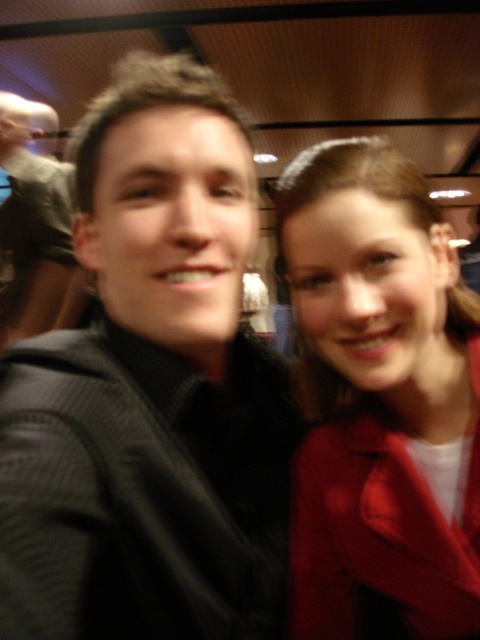
Question: Which point appears farthest from the camera in this image?

Choices:
 (A) (336, 195)
 (B) (12, 170)

Answer: (B)

Question: Which object appears farthest from the camera in this image?

Choices:
 (A) matte red coat at right
 (B) matte black sweater at center

Answer: (B)

Question: Does matte red coat at right have a larger size compared to matte black sweater at center?

Choices:
 (A) yes
 (B) no

Answer: (B)

Question: Is the position of matte red coat at right less distant than that of matte black sweater at center?

Choices:
 (A) no
 (B) yes

Answer: (B)

Question: Among these points, which one is farthest from the camera?

Choices:
 (A) 374,348
 (B) 0,321

Answer: (B)

Question: Observing the image, what is the correct spatial positioning of matte red coat at right in reference to matte black sweater at center?

Choices:
 (A) left
 (B) right

Answer: (B)